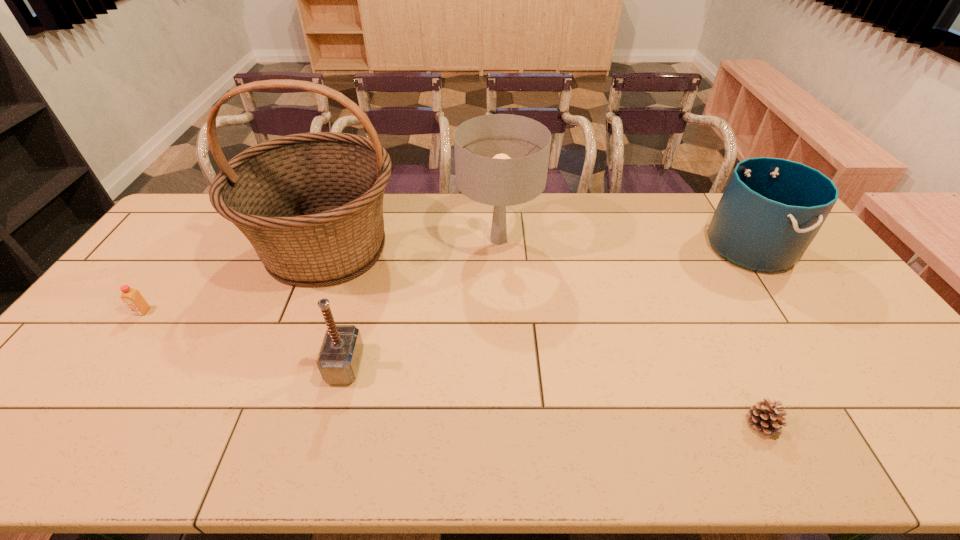
In order to click on free space between the hammer and the second object from right to left in this screenshot , I will do `click(554, 394)`.

Locate an element on the screen. free space that is in between the bucket and the second tallest object is located at coordinates (624, 243).

This screenshot has height=540, width=960. I want to click on free point between the hammer and the bucket, so click(547, 306).

This screenshot has height=540, width=960. Identify the location of vacant space that's between the nearest object and the orange juice. (452, 368).

Where is `object that is the closest to the third object from right to left`? This screenshot has width=960, height=540. object that is the closest to the third object from right to left is located at coordinates (311, 204).

Locate an element on the screen. The height and width of the screenshot is (540, 960). object that is the second closest to the bucket is located at coordinates (502, 160).

This screenshot has width=960, height=540. What are the coordinates of `vacant point that satisfies the following two spatial constraints: 1. on the front and back of the second nearest object; 2. on the right side of the second shortest object` in the screenshot? It's located at (104, 364).

At what (x,y) coordinates should I click in order to perform the action: click on free location that satisfies the following two spatial constraints: 1. on the front-facing side of the third object from right to left; 2. on the right side of the rightmost object. Please return your answer as a coordinate pair (x, y). The width and height of the screenshot is (960, 540). Looking at the image, I should click on (499, 246).